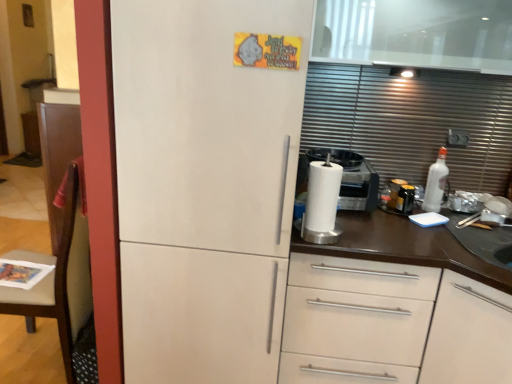
Question: Do you think brown wood chair at left is within white matte refrigerator at center, or outside of it?

Choices:
 (A) outside
 (B) inside

Answer: (A)

Question: Visually, is brown wood chair at left positioned to the left or to the right of white matte refrigerator at center?

Choices:
 (A) left
 (B) right

Answer: (A)

Question: Which of these objects is positioned farthest from the brown wood chair at left?

Choices:
 (A) white matte cabinet at center
 (B) white matte refrigerator at center

Answer: (A)

Question: Which is nearer to the white matte refrigerator at center?

Choices:
 (A) white matte cabinet at center
 (B) brown wood chair at left

Answer: (A)